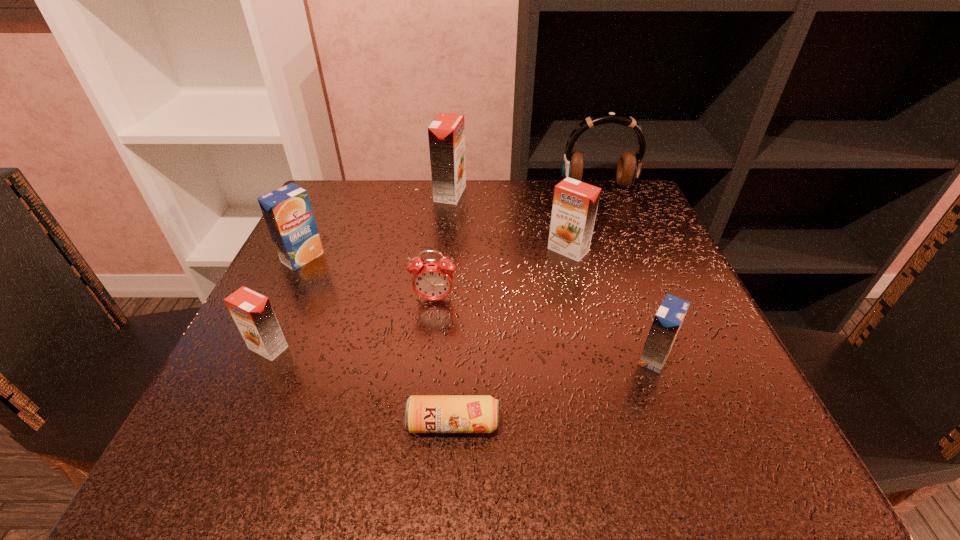
Where is `vacant area between the second smallest orange orange juice and the right blue orange_juice`? Image resolution: width=960 pixels, height=540 pixels. vacant area between the second smallest orange orange juice and the right blue orange_juice is located at coordinates (612, 304).

The image size is (960, 540). Find the location of `vacant point located between the headset and the third orange juice from right to left`. vacant point located between the headset and the third orange juice from right to left is located at coordinates (524, 190).

What are the coordinates of `blank region between the red alarm clock and the left blue orange_juice` in the screenshot? It's located at (369, 279).

Identify the location of vacant point located between the headset and the fifth farthest object. (516, 243).

You are a GUI agent. You are given a task and a screenshot of the screen. Output one action in this format:
    pyautogui.click(x=<x>, y=<y>)
    Task: Click on the object identified as the fifth closest to the second biggest orange orange juice
    The image size is (960, 540).
    Given the screenshot: What is the action you would take?
    pyautogui.click(x=423, y=413)

I want to click on the fourth closest object to the beer can, so click(575, 203).

Select which orange juice appears as the second closest to the nearest orange orange juice. Please provide its 2D coordinates. Your answer should be formatted as a tuple, i.e. [(x, y)], where the tuple contains the x and y coordinates of a point satisfying the conditions above.

[(446, 133)]

At what (x,y) coordinates should I click in order to perform the action: click on orange juice that is the third nearest to the smaller blue orange_juice. Please return your answer as a coordinate pair (x, y). The height and width of the screenshot is (540, 960). Looking at the image, I should click on (252, 312).

The width and height of the screenshot is (960, 540). Find the location of `orange orange juice that is the second closest to the leftmost orange orange juice`. orange orange juice that is the second closest to the leftmost orange orange juice is located at coordinates (575, 203).

You are a GUI agent. You are given a task and a screenshot of the screen. Output one action in this format:
    pyautogui.click(x=<x>, y=<y>)
    Task: Click on the second closest orange orange juice relative to the smaller blue orange_juice
    The height and width of the screenshot is (540, 960).
    Given the screenshot: What is the action you would take?
    pyautogui.click(x=446, y=133)